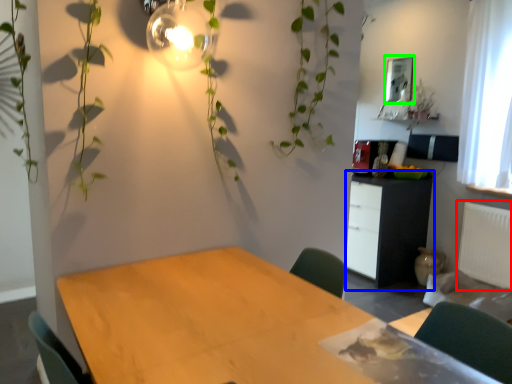
Question: Which is nearer to the radiator (highlighted by a red box)? cabinetry (highlighted by a blue box) or picture frame (highlighted by a green box).

Choices:
 (A) cabinetry
 (B) picture frame

Answer: (A)